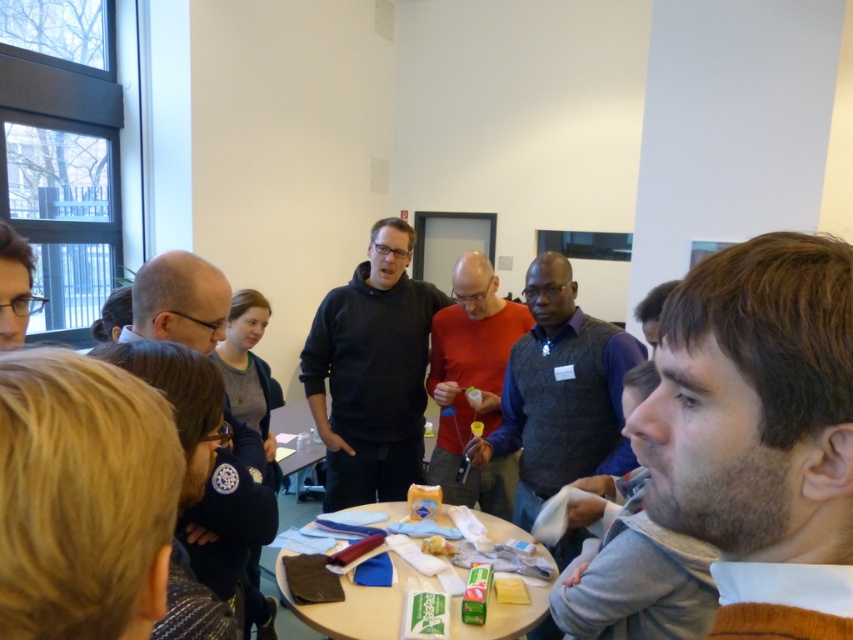
You are organizing a small party and need to place the black matte jacket at left and the yellow matte cheese at center on a shelf. Since you want to ensure stability, which object should you place at the bottom shelf?

The black matte jacket at left is larger than the yellow matte cheese at center, so it should be placed at the bottom shelf for stability.

You are organizing a small event and need to place a decorative centerpiece on the wooden table at center. Considering the size of the matte red shirt at center, will the centerpiece fit comfortably without overcrowding the table?

The matte red shirt at center has a larger size compared to the wooden table at center. Since the shirt is larger than the table, placing a centerpiece might not be feasible as there may not be enough space left on the table.

You are a person sitting at the round table in the conference room. You need to reach for the yellow matte cheese at center without moving your chair. Can you do it easily if the brown fuzzy hair at center is in the way?

The brown fuzzy hair at center is located above yellow matte cheese at center, so it is blocking access to the yellow matte cheese at center. You would need to move the brown fuzzy hair at center first to reach the yellow matte cheese at center easily.